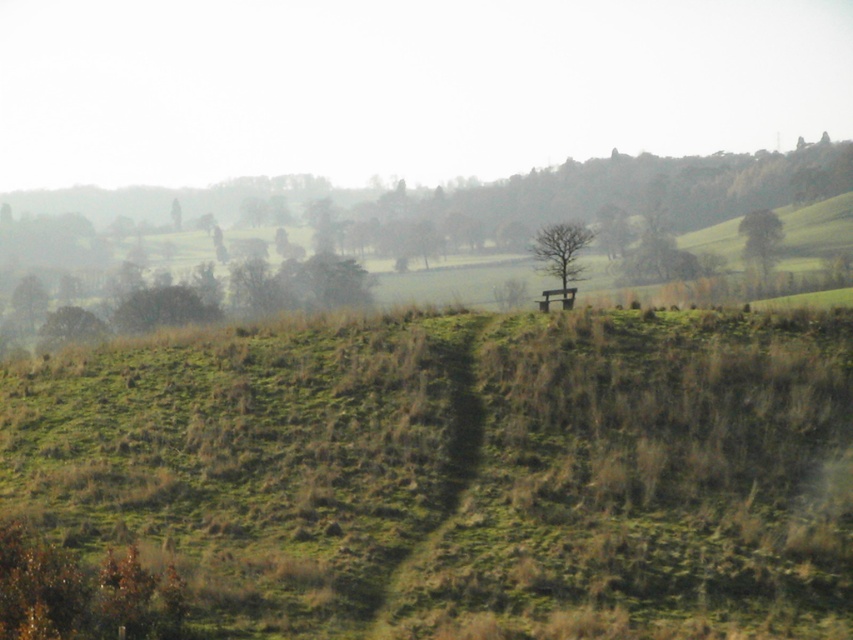
Is green leafy tree at upper right smaller than green grassy hill at upper center?

Incorrect, green leafy tree at upper right is not smaller in size than green grassy hill at upper center.

Can you confirm if green leafy tree at upper right is wider than green grassy hill at upper center?

Indeed, green leafy tree at upper right has a greater width compared to green grassy hill at upper center.

The width and height of the screenshot is (853, 640). Describe the element at coordinates (759, 237) in the screenshot. I see `green leafy tree at upper right` at that location.

The height and width of the screenshot is (640, 853). In order to click on green leafy tree at upper right in this screenshot , I will do `click(759, 237)`.

Between point (573, 241) and point (764, 253), which one is positioned behind?

The point (764, 253) is more distant.

In the scene shown: Measure the distance between point [578,269] and camera.

Point [578,269] is 26.07 meters away from camera.

From the picture: Measure the distance between point (543, 268) and camera.

Point (543, 268) and camera are 26.62 meters apart from each other.

The width and height of the screenshot is (853, 640). I want to click on bare wood tree at center, so 560,257.

Who is more distant from viewer, (555, 230) or (96, 324)?

Positioned behind is point (96, 324).

Is bare wood tree at center to the left of green grassy tree at left from the viewer's perspective?

In fact, bare wood tree at center is to the right of green grassy tree at left.

Does point (558, 291) come farther from viewer compared to point (67, 305)?

No.

The image size is (853, 640). I want to click on bare wood tree at center, so click(560, 257).